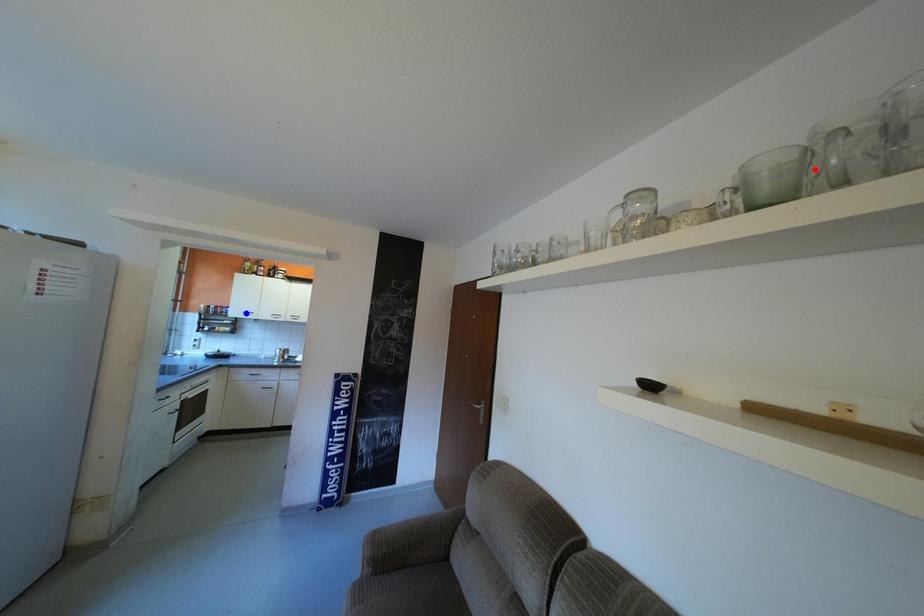
Question: In the image, two points are highlighted. Which point is nearer to the camera? Reply with the corresponding letter.

Choices:
 (A) blue point
 (B) red point

Answer: (B)